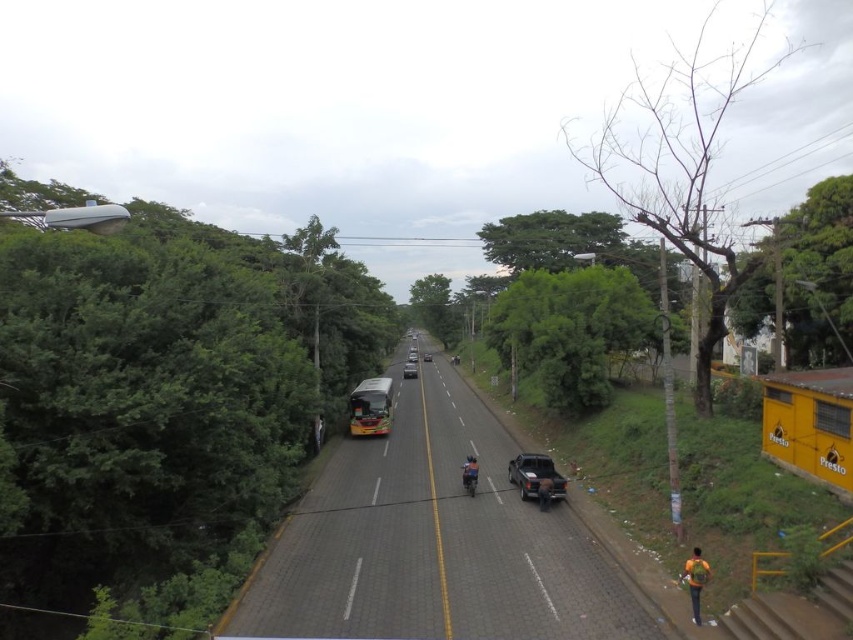
Image resolution: width=853 pixels, height=640 pixels. What do you see at coordinates (165, 390) in the screenshot?
I see `green leafy tree at left` at bounding box center [165, 390].

Which is more to the left, green leafy tree at left or green leafy tree at upper right?

From the viewer's perspective, green leafy tree at left appears more on the left side.

Does point (44, 589) come in front of point (801, 234)?

Yes, it is.

At what (x,y) coordinates should I click in order to perform the action: click on green leafy tree at left. Please return your answer as a coordinate pair (x, y). Looking at the image, I should click on (165, 390).

Between point (100, 289) and point (697, 189), which one is positioned in front?

Point (100, 289) is in front.

Between green leafy tree at left and bare wood tree at right, which one appears on the left side from the viewer's perspective?

green leafy tree at left

What are the coordinates of `green leafy tree at left` in the screenshot? It's located at (165, 390).

Can you confirm if bare wood tree at right is positioned below green leafy tree at center?

Incorrect, bare wood tree at right is not positioned below green leafy tree at center.

Is bare wood tree at right bigger than green leafy tree at center?

Correct, bare wood tree at right is larger in size than green leafy tree at center.

In order to click on bare wood tree at right in this screenshot , I will do `click(682, 161)`.